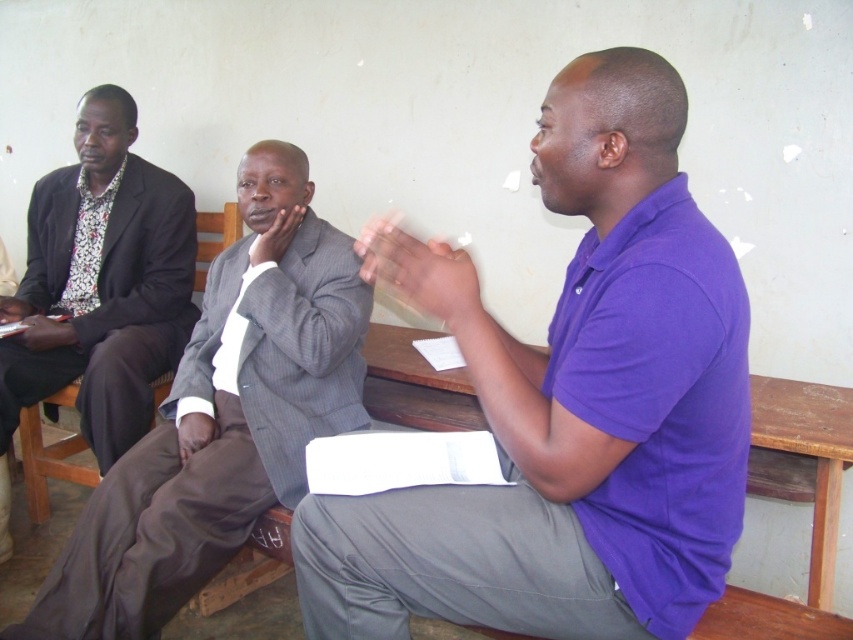
Who is positioned more to the left, gray pinstripe suit at center or floral print shirt at left?

floral print shirt at left is more to the left.

Is point (297, 500) less distant than point (103, 305)?

That is True.

Is point (364, 314) less distant than point (169, 337)?

Yes, it is in front of point (169, 337).

Locate an element on the screen. gray pinstripe suit at center is located at coordinates (222, 417).

Between purple cotton shirt at center and floral print shirt at left, which one is positioned higher?

Positioned higher is floral print shirt at left.

Find the location of a particular element. Image resolution: width=853 pixels, height=640 pixels. purple cotton shirt at center is located at coordinates (567, 404).

I want to click on purple cotton shirt at center, so click(x=567, y=404).

Who is taller, purple cotton shirt at center or gray pinstripe suit at center?

gray pinstripe suit at center is taller.

Is point (688, 531) farther from viewer compared to point (61, 628)?

No.

Does point (350, 600) lie behind point (231, 355)?

No, it is in front of (231, 355).

Where is `purple cotton shirt at center`? The height and width of the screenshot is (640, 853). purple cotton shirt at center is located at coordinates tap(567, 404).